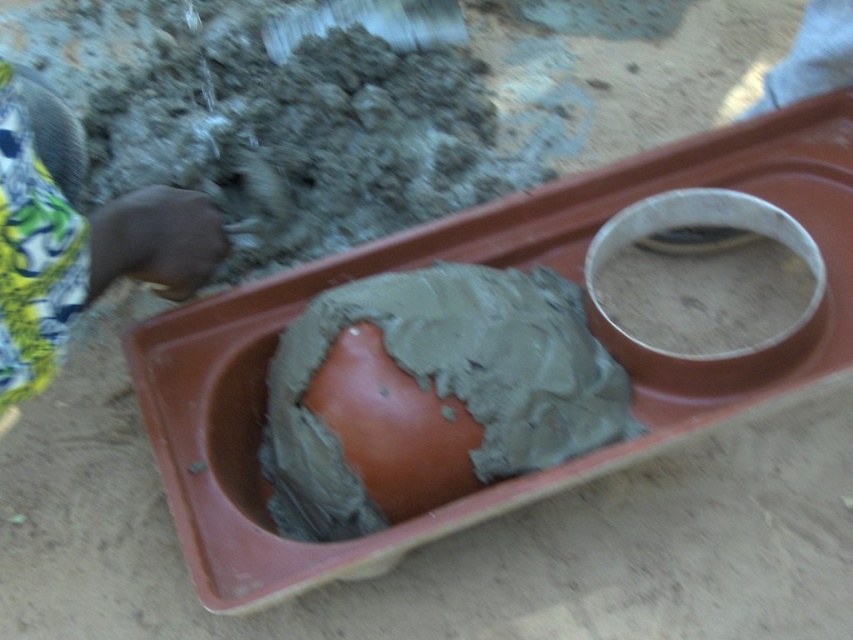
Identify the location of textured fabric hand at upper left. Image resolution: width=853 pixels, height=640 pixels. (80, 250).

Between textured fabric hand at upper left and gray matte mud at upper right, which one has more height?

textured fabric hand at upper left is taller.

Does point (71, 214) lie behind point (648, 264)?

No, (71, 214) is in front of (648, 264).

Locate an element on the screen. Image resolution: width=853 pixels, height=640 pixels. textured fabric hand at upper left is located at coordinates (80, 250).

Describe the element at coordinates (444, 384) in the screenshot. I see `gray matte mud at center` at that location.

Does gray matte mud at center have a smaller size compared to gray matte mud at upper right?

Actually, gray matte mud at center might be larger than gray matte mud at upper right.

Is point (527, 417) farther from viewer compared to point (778, 269)?

No, (527, 417) is in front of (778, 269).

Find the location of a particular element. The image size is (853, 640). gray matte mud at center is located at coordinates (444, 384).

Which of these two, gray matte mud at center or textured fabric hand at upper left, stands shorter?

textured fabric hand at upper left is shorter.

This screenshot has height=640, width=853. In order to click on gray matte mud at center in this screenshot , I will do pos(444,384).